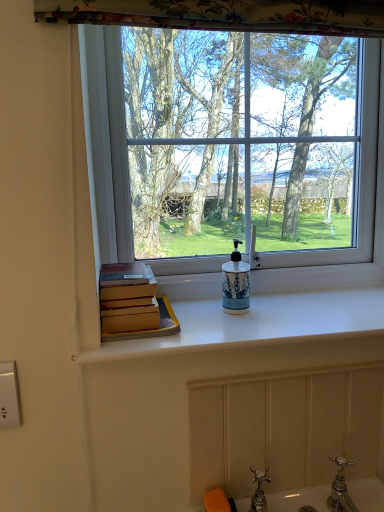
Find the location of a particular element. free point to the left of blue and white ceramic soap dispenser at center is located at coordinates (193, 317).